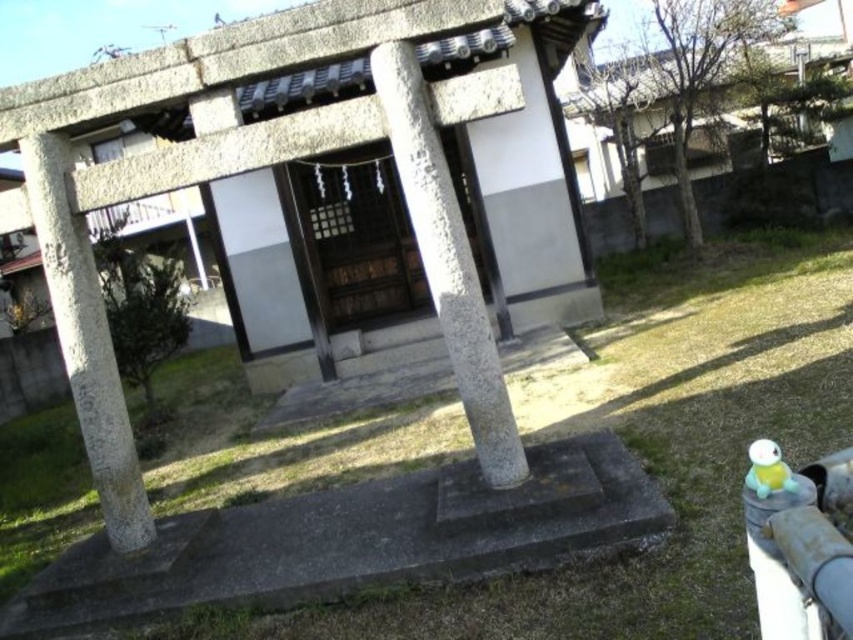
You are a visitor approaching the torii gate and the shrine. You want to know which structure is taller between the gray stone pillar at center and the wooden door at center. Can you tell me?

The gray stone pillar at center has a greater height compared to the wooden door at center, so the gray stone pillar at center is taller.